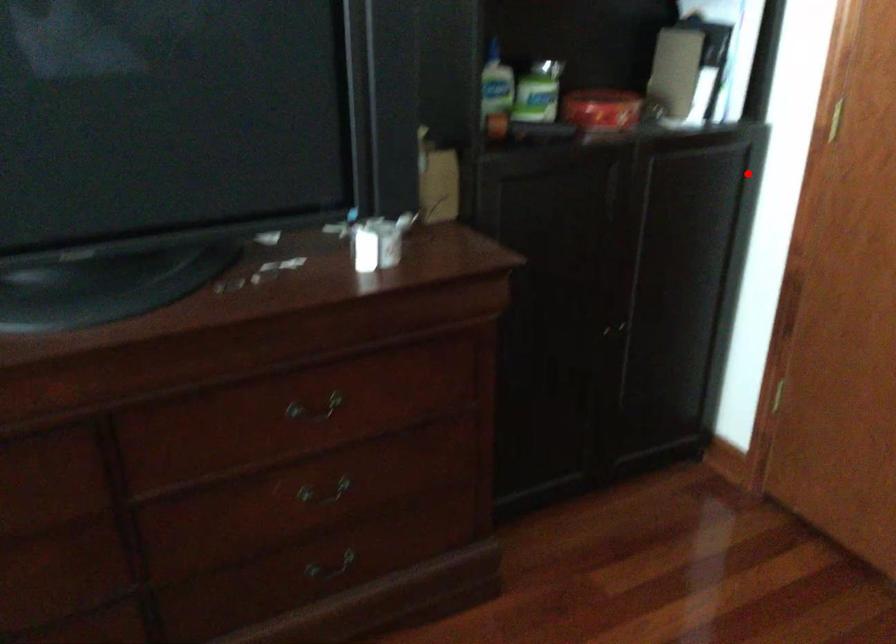
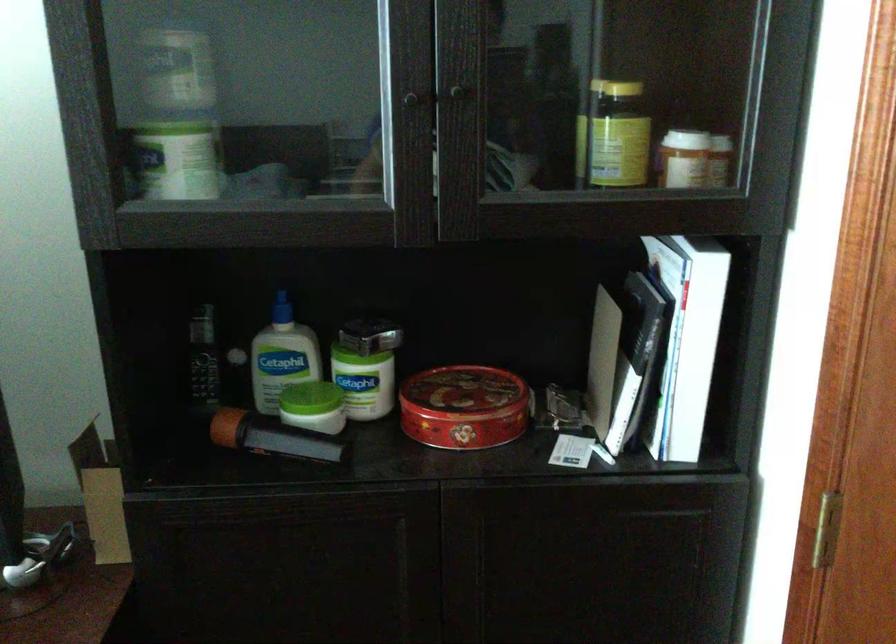
Locate, in the second image, the point that corresponds to the highlighted location in the first image.

(707, 554)